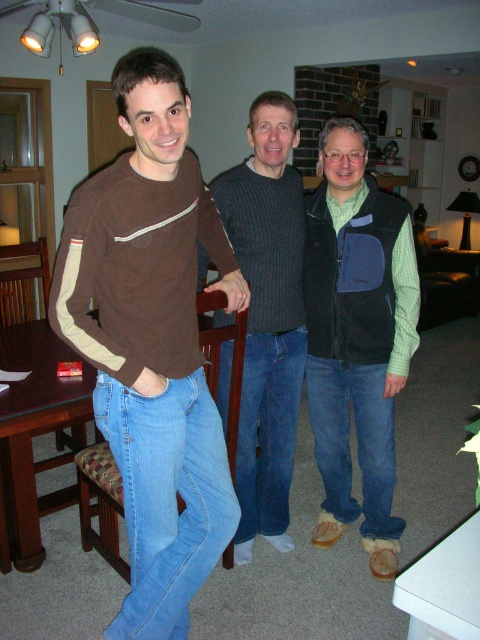
You are trying to decide whether to place a new large decorative item on the green textured vest at center or the brown wooden dining table at center. Based on their sizes, which surface would be more appropriate for the large item?

The brown wooden dining table at center is larger than the green textured vest at center, so the large decorative item should be placed on the brown wooden dining table at center.

You are standing in the living room and want to pick up the green textured vest at center. To reach it, you need to walk around the brown wooden dining table at center. Which direction should you move first?

The green textured vest at center is closer to you than the brown wooden dining table at center, so you should move towards the green textured vest at center first, then navigate around the brown wooden dining table at center as needed.

You are trying to decide whether to place a new decorative item on the brown cotton shirt at center or the brown wooden dining table at center. Based on their widths, which surface would be more suitable for a wider item?

The brown wooden dining table at center has a greater width than the brown cotton shirt at center, so it would be more suitable for placing a wider decorative item.